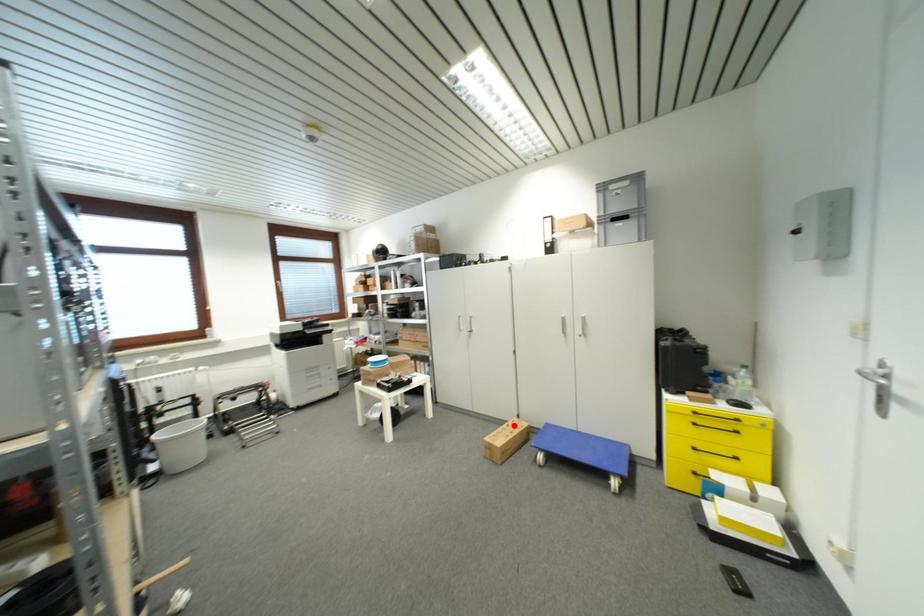
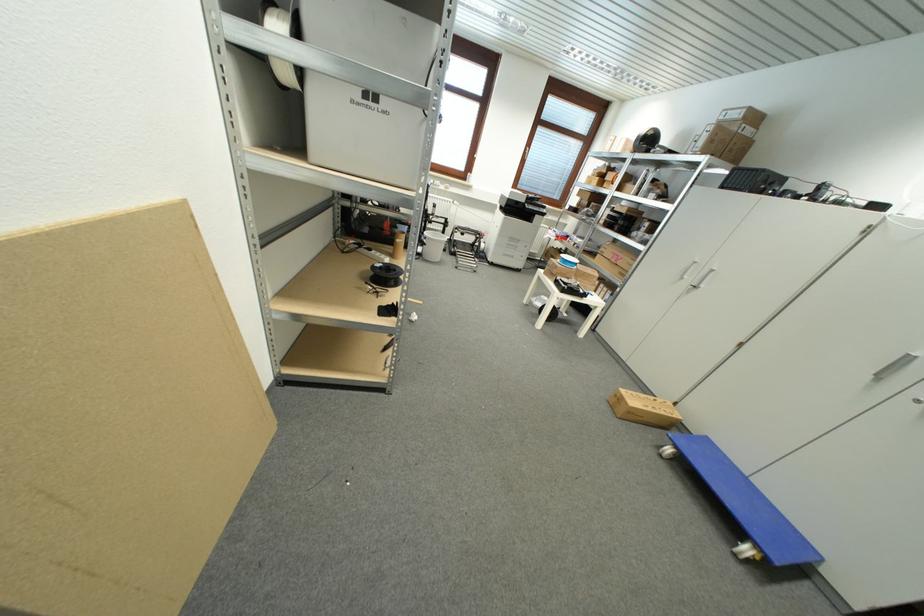
Where in the second image is the point corresponding to the highlighted location from the first image?

(663, 402)